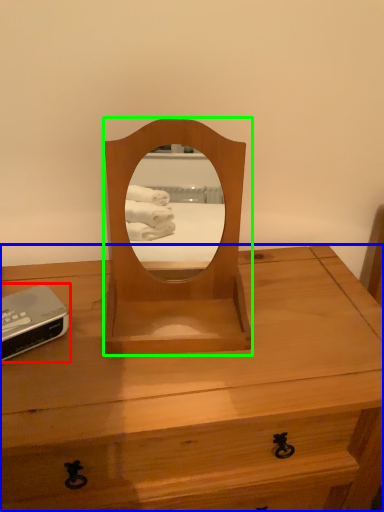
Question: Which object is the closest to the gadget (highlighted by a red box)? Choose among these: desk (highlighted by a blue box) or mirror (highlighted by a green box).

Choices:
 (A) desk
 (B) mirror

Answer: (B)